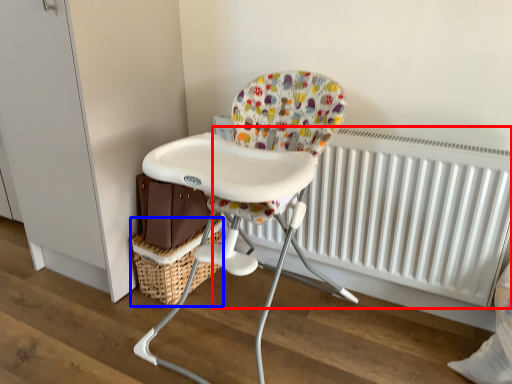
Question: Which of the following is the closest to the observer, radiator (highlighted by a red box) or basket (highlighted by a blue box)?

Choices:
 (A) radiator
 (B) basket

Answer: (A)